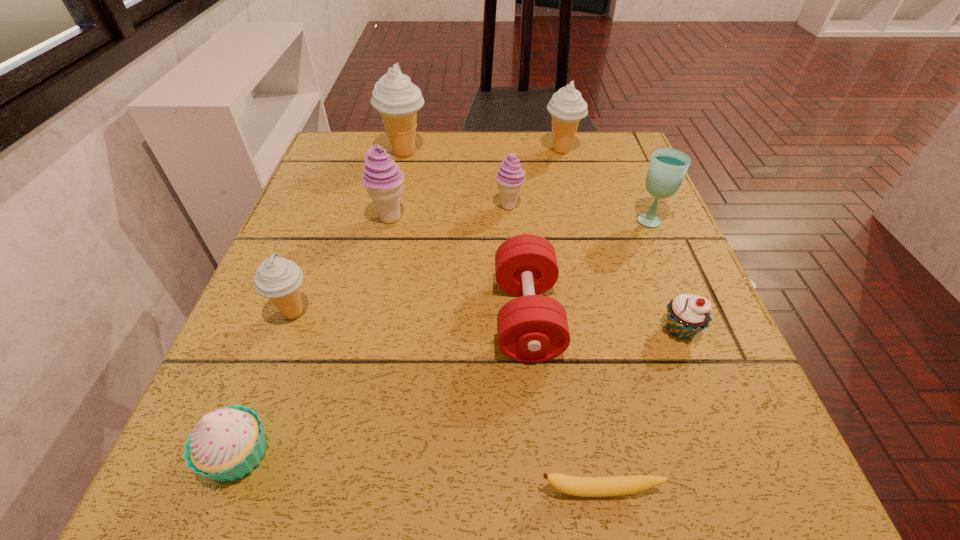
Locate an element on the screen. The width and height of the screenshot is (960, 540). the second beige icecream from right to left is located at coordinates (395, 97).

What are the coordinates of `the tallest object` in the screenshot? It's located at (395, 97).

Identify the location of the rightmost icecream. (567, 107).

The image size is (960, 540). Find the location of `the second biggest beige icecream`. the second biggest beige icecream is located at coordinates (567, 107).

Where is `the bigger purple icecream`? the bigger purple icecream is located at coordinates (382, 178).

Find the location of a particular element. The height and width of the screenshot is (540, 960). glass is located at coordinates (668, 167).

The image size is (960, 540). I want to click on the fourth icecream from left to right, so click(510, 176).

The width and height of the screenshot is (960, 540). Find the location of `the right purple icecream`. the right purple icecream is located at coordinates (510, 176).

Where is `the smallest beige icecream`? This screenshot has width=960, height=540. the smallest beige icecream is located at coordinates (277, 278).

Locate an element on the screen. The height and width of the screenshot is (540, 960). the leftmost icecream is located at coordinates (277, 278).